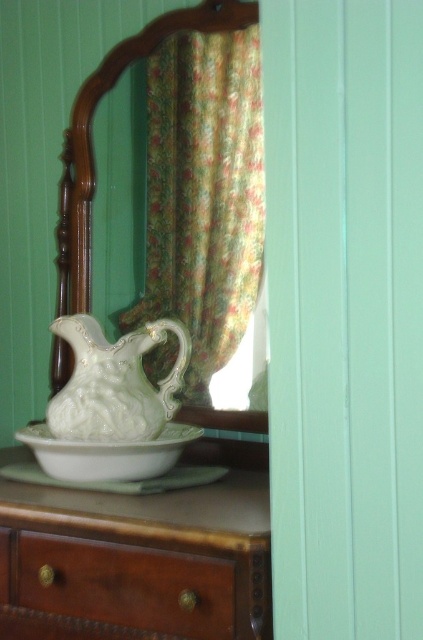
Between point (220, 173) and point (132, 600), which one is positioned in front?

Positioned in front is point (132, 600).

Who is more forward, (197, 394) or (82, 586)?

Positioned in front is point (82, 586).

Where is `floral fabric curtain at upper center`? The height and width of the screenshot is (640, 423). floral fabric curtain at upper center is located at coordinates [x=203, y=196].

Between white porcelain pitcher at center and white glossy plate at center, which one has more height?

Standing taller between the two is white porcelain pitcher at center.

Is white porcelain pitcher at center shorter than white glossy plate at center?

No, white porcelain pitcher at center is not shorter than white glossy plate at center.

Is point (54, 332) farther from viewer compared to point (44, 433)?

No, (54, 332) is in front of (44, 433).

I want to click on white porcelain pitcher at center, so click(x=115, y=381).

Can you confirm if wooden drawer at lower left is positioned to the right of white glossy plate at center?

Correct, you'll find wooden drawer at lower left to the right of white glossy plate at center.

Looking at this image, which is more to the left, wooden drawer at lower left or white glossy plate at center?

white glossy plate at center is more to the left.

The image size is (423, 640). Identify the location of wooden drawer at lower left. (126, 586).

At what (x,y) coordinates should I click in order to perform the action: click on wooden drawer at lower left. Please return your answer as a coordinate pair (x, y). Looking at the image, I should click on (126, 586).